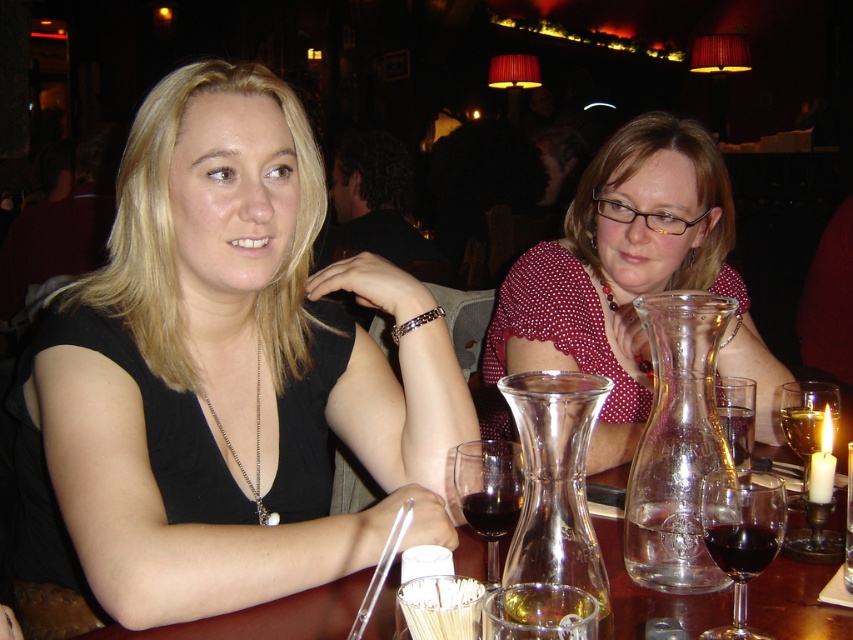
Question: Considering the relative positions of translucent glass wine glass at center and dark red liquid at table center in the image provided, where is translucent glass wine glass at center located with respect to dark red liquid at table center?

Choices:
 (A) below
 (B) above

Answer: (B)

Question: Which object is positioned closest to the translucent glass wine at table center?

Choices:
 (A) transparent glass carafe at center
 (B) ruby glass at table center
 (C) translucent glass wine glass at upper right
 (D) clear glass wine glass at center

Answer: (C)

Question: Among these points, which one is farthest from the camera?

Choices:
 (A) (512, 483)
 (B) (381, 435)
 (C) (753, 403)

Answer: (C)

Question: Among these points, which one is farthest from the camera?

Choices:
 (A) (750, 456)
 (B) (636, 401)
 (C) (466, 502)

Answer: (B)

Question: Is ruby glass at table center smaller than translucent glass wine at table center?

Choices:
 (A) no
 (B) yes

Answer: (A)

Question: Can you confirm if ruby glass at table center is thinner than translucent glass wine at table center?

Choices:
 (A) yes
 (B) no

Answer: (A)